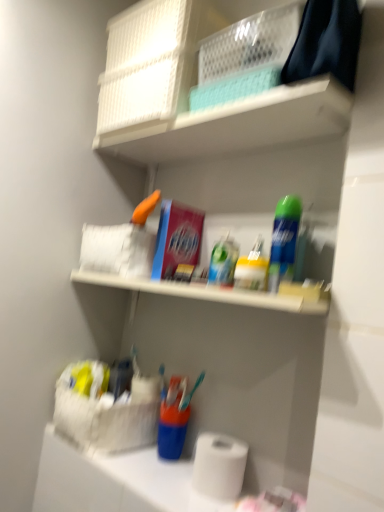
Question: Would you say translucent plastic toothpaste at center, which ranks as the second toiletry in right-to-left order, is inside or outside white mesh basket at upper center?

Choices:
 (A) outside
 (B) inside

Answer: (A)

Question: Is translucent plastic toothpaste at center, which ranks as the second toiletry in right-to-left order, wider or thinner than white mesh basket at upper center?

Choices:
 (A) thin
 (B) wide

Answer: (A)

Question: Considering the real-world distances, which object is farthest from the translucent plastic container at center, which is the first toiletry in right-to-left order?

Choices:
 (A) white matte paper towel at lower center
 (B) translucent plastic toothpaste at center, which ranks as the second toiletry in right-to-left order
 (C) white mesh basket at upper center
 (D) white matte toilet paper at lower center
 (E) green matte spray can at upper right

Answer: (A)

Question: Estimate the real-world distances between objects in this image. Which object is closer to the white matte paper towel at lower center?

Choices:
 (A) translucent plastic toothpaste at center, the first toiletry viewed from the left
 (B) white mesh basket at upper center
 (C) white matte toilet paper at lower center
 (D) translucent plastic container at center, which is the second toiletry from left to right
 (E) green matte spray can at upper right

Answer: (C)